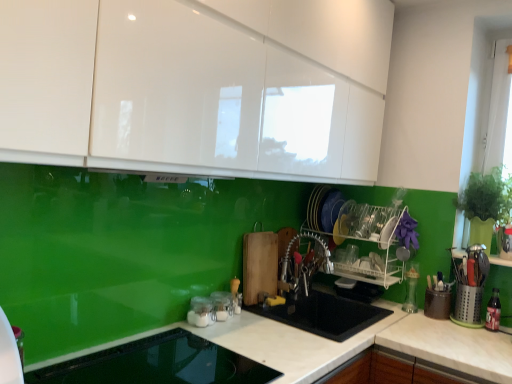
Locate an element on the screen. white glossy cabinets at upper center is located at coordinates (197, 86).

What do you see at coordinates (370, 240) in the screenshot? The image size is (512, 384). I see `white plastic dish rack at center, the first appliance in the back-to-front sequence` at bounding box center [370, 240].

What do you see at coordinates (222, 305) in the screenshot? This screenshot has height=384, width=512. I see `clear glass jars at center, the fourth appliance from the right` at bounding box center [222, 305].

At what (x,y) coordinates should I click in order to perform the action: click on clear plastic bottle at right, arranged as the sixth appliance when viewed from the left. Please return your answer as a coordinate pair (x, y). Looking at the image, I should click on (493, 311).

This screenshot has width=512, height=384. What do you see at coordinates (201, 312) in the screenshot? I see `clear glass jars at lower center, which is counted as the second appliance, starting from the front` at bounding box center [201, 312].

Where is `clear glass jars at lower center, which is counted as the second appliance, starting from the front`? Image resolution: width=512 pixels, height=384 pixels. clear glass jars at lower center, which is counted as the second appliance, starting from the front is located at coordinates (201, 312).

Consider the image. Measure the distance between metallic silver utensils at center and camera.

metallic silver utensils at center and camera are 6.70 feet apart from each other.

This screenshot has height=384, width=512. Identify the location of metallic silver utensils at center. (303, 265).

Where is `green glossy plant at right`? green glossy plant at right is located at coordinates (487, 197).

Does point (480, 268) appear closer or farther from the camera than point (213, 321)?

Point (480, 268).

Is metallic silver utensil holder at right, which is counted as the fifth appliance, starting from the left, positioned with its back to clear glass jars at lower center, which is counted as the second appliance, starting from the front?

No, metallic silver utensil holder at right, which is counted as the fifth appliance, starting from the left, is not facing away from clear glass jars at lower center, which is counted as the second appliance, starting from the front.

From a real-world perspective, which object stands above the other?

From a 3D spatial view, metallic silver utensil holder at right, which is counted as the fifth appliance, starting from the left, is above.

Can you confirm if metallic silver utensil holder at right, the 4th appliance viewed from the front, is wider than clear glass jars at lower center, which is counted as the 5th appliance, starting from the back?

Yes.

From the image's perspective, is white plastic dish rack at center, the third appliance when ordered from right to left, under white glossy countertop at center?

No.

Does point (361, 267) lie behind point (287, 371)?

Yes, point (361, 267) is behind point (287, 371).

Is white plastic dish rack at center, the first appliance in the back-to-front sequence, taller or shorter than white glossy countertop at center?

Clearly, white plastic dish rack at center, the first appliance in the back-to-front sequence, is shorter compared to white glossy countertop at center.

In the scene shown: Does metallic silver utensil holder at right, the 4th appliance viewed from the front, turn towards white glossy countertop at center?

No.

Which object is thinner, metallic silver utensil holder at right, which appears as the third appliance when viewed from the back, or white glossy countertop at center?

With smaller width is metallic silver utensil holder at right, which appears as the third appliance when viewed from the back.

Based on the photo, what's the angular difference between metallic silver utensil holder at right, the 4th appliance viewed from the front, and white glossy countertop at center's facing directions?

metallic silver utensil holder at right, the 4th appliance viewed from the front, and white glossy countertop at center are facing 90 degrees away from each other.

From a real-world perspective, is metallic silver utensil holder at right, the 4th appliance viewed from the front, beneath white glossy countertop at center?

No, from a real-world perspective, metallic silver utensil holder at right, the 4th appliance viewed from the front, is not below white glossy countertop at center.

Which object is positioned more to the left, metallic silver utensil holder at right, the second appliance positioned from the right, or smooth glass cooktop at lower center, the 6th appliance when ordered from back to front?

smooth glass cooktop at lower center, the 6th appliance when ordered from back to front, is more to the left.

From the image's perspective, relative to smooth glass cooktop at lower center, which is the 6th appliance in right-to-left order, is metallic silver utensil holder at right, which is counted as the fifth appliance, starting from the left, above or below?

metallic silver utensil holder at right, which is counted as the fifth appliance, starting from the left, is situated higher than smooth glass cooktop at lower center, which is the 6th appliance in right-to-left order, in the image.

From a real-world perspective, is metallic silver utensil holder at right, which is counted as the fifth appliance, starting from the left, beneath smooth glass cooktop at lower center, which is the 6th appliance in right-to-left order?

No, from a real-world perspective, metallic silver utensil holder at right, which is counted as the fifth appliance, starting from the left, is not under smooth glass cooktop at lower center, which is the 6th appliance in right-to-left order.

Can you confirm if white glossy countertop at center is positioned to the left of white plastic dish rack at center, placed as the sixth appliance when sorted from front to back?

Yes.

Is white glossy countertop at center not close to white plastic dish rack at center, placed as the sixth appliance when sorted from front to back?

Actually, white glossy countertop at center and white plastic dish rack at center, placed as the sixth appliance when sorted from front to back, are a little close together.

Considering the sizes of white glossy countertop at center and white plastic dish rack at center, the first appliance in the back-to-front sequence, in the image, is white glossy countertop at center taller or shorter than white plastic dish rack at center, the first appliance in the back-to-front sequence,?

In the image, white glossy countertop at center appears to be taller than white plastic dish rack at center, the first appliance in the back-to-front sequence.

From a real-world perspective, between clear glass jars at lower center, arranged as the 5th appliance when viewed from the right, and white glossy cabinets at upper center, who is vertically higher?

From a 3D spatial view, white glossy cabinets at upper center is above.

Considering the sizes of objects clear glass jars at lower center, which is counted as the 5th appliance, starting from the back, and white glossy cabinets at upper center in the image provided, who is bigger, clear glass jars at lower center, which is counted as the 5th appliance, starting from the back, or white glossy cabinets at upper center?

white glossy cabinets at upper center.

Looking at this image, does clear glass jars at lower center, the second appliance in the left-to-right sequence, contain white glossy cabinets at upper center?

Definitely not — white glossy cabinets at upper center is not inside clear glass jars at lower center, the second appliance in the left-to-right sequence.

Consider the image. Does clear glass jars at lower center, the second appliance in the left-to-right sequence, turn towards white glossy cabinets at upper center?

No, clear glass jars at lower center, the second appliance in the left-to-right sequence, does not turn towards white glossy cabinets at upper center.

Is white glossy cabinets at upper center to the right of smooth glass cooktop at lower center, the first appliance when ordered from left to right, from the viewer's perspective?

Indeed, white glossy cabinets at upper center is positioned on the right side of smooth glass cooktop at lower center, the first appliance when ordered from left to right.

Does white glossy cabinets at upper center come behind smooth glass cooktop at lower center, which is the 6th appliance in right-to-left order?

No, it is in front of smooth glass cooktop at lower center, which is the 6th appliance in right-to-left order.

Would you say white glossy cabinets at upper center is inside or outside smooth glass cooktop at lower center, which is the 6th appliance in right-to-left order?

white glossy cabinets at upper center is not inside smooth glass cooktop at lower center, which is the 6th appliance in right-to-left order, it's outside.

Is white glossy cabinets at upper center next to smooth glass cooktop at lower center, the 6th appliance when ordered from back to front?

They are not placed beside each other.

Locate an element on the screen. the 3rd appliance to the left of the metallic silver utensil holder at right, which appears as the third appliance when viewed from the back, counting from the anchor's position is located at coordinates (201, 312).

Identify the location of appliance that is the 6th object located behind the white glossy countertop at center. (370, 240).

Looking at the image, which one is located closer to white glossy countertop at center, clear glass jars at center, marked as the 3th appliance in a front-to-back arrangement, or white glossy cabinets at upper center?

clear glass jars at center, marked as the 3th appliance in a front-to-back arrangement.

Looking at the image, which one is located closer to clear glass jars at center, marked as the 3th appliance in a front-to-back arrangement, white plastic dish rack at center, which is the 4th appliance from left to right, or white glossy countertop at center?

white glossy countertop at center lies closer to clear glass jars at center, marked as the 3th appliance in a front-to-back arrangement, than the other object.

Based on their spatial positions, is green glossy plant at right or white glossy countertop at center further from metallic silver utensil holder at right, which appears as the third appliance when viewed from the back?

white glossy countertop at center lies further to metallic silver utensil holder at right, which appears as the third appliance when viewed from the back, than the other object.

When comparing their distances from green glossy plant at right, does white glossy cabinets at upper center or metallic silver utensils at center seem closer?

metallic silver utensils at center.

Which object lies further to the anchor point white glossy countertop at center, metallic silver utensil holder at right, which appears as the third appliance when viewed from the back, or clear glass jars at lower center, which is counted as the second appliance, starting from the front?

metallic silver utensil holder at right, which appears as the third appliance when viewed from the back, is further to white glossy countertop at center.

Which object lies nearer to the anchor point clear plastic bottle at right, the 2th appliance viewed from the back, white plastic dish rack at center, the first appliance in the back-to-front sequence, or metallic silver utensil holder at right, which appears as the third appliance when viewed from the back?

metallic silver utensil holder at right, which appears as the third appliance when viewed from the back, lies closer to clear plastic bottle at right, the 2th appliance viewed from the back, than the other object.

When comparing their distances from clear glass jars at lower center, which is counted as the 5th appliance, starting from the back, does metallic silver utensil holder at right, which is counted as the fifth appliance, starting from the left, or metallic silver utensils at center seem closer?

Among the two, metallic silver utensils at center is located nearer to clear glass jars at lower center, which is counted as the 5th appliance, starting from the back.

Which object lies nearer to the anchor point metallic silver utensil holder at right, which appears as the third appliance when viewed from the back, green glossy plant at right or clear plastic bottle at right, which is the first appliance from right to left?

clear plastic bottle at right, which is the first appliance from right to left, is closer to metallic silver utensil holder at right, which appears as the third appliance when viewed from the back.

In order to click on countertop between clear glass jars at lower center, arranged as the 5th appliance when viewed from the right, and clear plastic bottle at right, arranged as the sixth appliance when viewed from the left, in the horizontal direction in this screenshot , I will do `click(272, 344)`.

Find the location of a particular element. appliance between white glossy countertop at center and clear glass jars at lower center, arranged as the 5th appliance when viewed from the right, along the z-axis is located at coordinates (158, 364).

At what (x,y) coordinates should I click in order to perform the action: click on countertop situated between smooth glass cooktop at lower center, the 6th appliance when ordered from back to front, and clear plastic bottle at right, which is the first appliance from right to left, from left to right. Please return your answer as a coordinate pair (x, y). The height and width of the screenshot is (384, 512). Looking at the image, I should click on (272, 344).

Locate an element on the screen. The image size is (512, 384). cabinetry between clear glass jars at center, the 4th appliance from the back, and green glossy plant at right, in the horizontal direction is located at coordinates (197, 86).